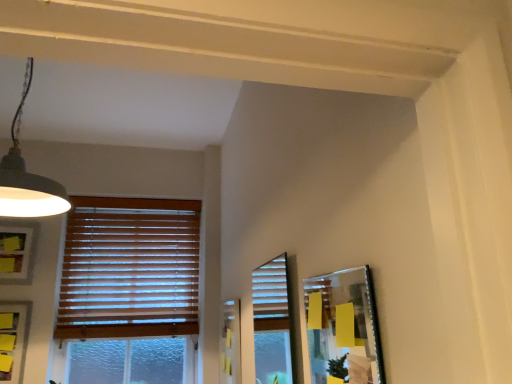
Describe the element at coordinates (130, 268) in the screenshot. I see `wooden blinds at left` at that location.

Image resolution: width=512 pixels, height=384 pixels. What do you see at coordinates (13, 339) in the screenshot?
I see `matte gray picture frame at lower left, which appears as the second picture frame when viewed from the right` at bounding box center [13, 339].

Describe the element at coordinates (27, 176) in the screenshot. I see `matte black lampshade at upper left` at that location.

Identify the location of metallic silver picture frame at right, placed as the 3th picture frame when sorted from left to right. coord(343,328).

Who is taller, metallic silver picture frame at right, placed as the 3th picture frame when sorted from left to right, or matte black lampshade at upper left?

matte black lampshade at upper left is taller.

Which object is closer to the camera taking this photo, metallic silver picture frame at right, marked as the first picture frame in a front-to-back arrangement, or matte black lampshade at upper left?

metallic silver picture frame at right, marked as the first picture frame in a front-to-back arrangement, is more forward.

Which is more to the right, metallic silver picture frame at right, arranged as the 1th picture frame when viewed from the right, or matte black lampshade at upper left?

metallic silver picture frame at right, arranged as the 1th picture frame when viewed from the right, is more to the right.

Is metallic silver picture frame at right, placed as the 3th picture frame when sorted from left to right, turned away from matte black lampshade at upper left?

No, metallic silver picture frame at right, placed as the 3th picture frame when sorted from left to right,'s orientation is not away from matte black lampshade at upper left.

In the scene shown: Which is more to the right, matte white picture frame at left, the 3th picture frame viewed from the front, or matte gray picture frame at lower left, the 2th picture frame in the left-to-right sequence?

From the viewer's perspective, matte gray picture frame at lower left, the 2th picture frame in the left-to-right sequence, appears more on the right side.

Would you consider matte white picture frame at left, which is the first picture frame from left to right, to be distant from matte gray picture frame at lower left, which is the second picture frame from back to front?

No, there isn't a large distance between matte white picture frame at left, which is the first picture frame from left to right, and matte gray picture frame at lower left, which is the second picture frame from back to front.

From the image's perspective, is matte white picture frame at left, positioned as the 3th picture frame in right-to-left order, beneath matte gray picture frame at lower left, acting as the second picture frame starting from the front?

No, from the image's perspective, matte white picture frame at left, positioned as the 3th picture frame in right-to-left order, is not beneath matte gray picture frame at lower left, acting as the second picture frame starting from the front.

From their relative heights in the image, would you say matte black lampshade at upper left is taller or shorter than matte white picture frame at left, which is the first picture frame in back-to-front order?

matte black lampshade at upper left is taller than matte white picture frame at left, which is the first picture frame in back-to-front order.

In the image, is matte black lampshade at upper left on the left side or the right side of matte white picture frame at left, positioned as the 3th picture frame in right-to-left order?

In the image, matte black lampshade at upper left appears on the right side of matte white picture frame at left, positioned as the 3th picture frame in right-to-left order.

Considering the relative positions of matte black lampshade at upper left and matte white picture frame at left, positioned as the 3th picture frame in right-to-left order, in the image provided, is matte black lampshade at upper left behind matte white picture frame at left, positioned as the 3th picture frame in right-to-left order,?

No, matte black lampshade at upper left is closer to the viewer.

Is matte white picture frame at left, the 3th picture frame viewed from the front, a part of matte black lampshade at upper left?

No, matte white picture frame at left, the 3th picture frame viewed from the front, is not a part of matte black lampshade at upper left.

Is metallic silver picture frame at right, marked as the first picture frame in a front-to-back arrangement, oriented towards matte gray picture frame at lower left, the 2th picture frame in the left-to-right sequence?

No, metallic silver picture frame at right, marked as the first picture frame in a front-to-back arrangement, does not turn towards matte gray picture frame at lower left, the 2th picture frame in the left-to-right sequence.

Who is smaller, metallic silver picture frame at right, placed as the 3th picture frame when sorted from left to right, or matte gray picture frame at lower left, which is the second picture frame from back to front?

matte gray picture frame at lower left, which is the second picture frame from back to front.

Does point (353, 279) lie behind point (15, 337)?

No, (353, 279) is in front of (15, 337).

Based on the photo, is metallic silver picture frame at right, marked as the first picture frame in a front-to-back arrangement, inside the boundaries of matte gray picture frame at lower left, which is the second picture frame from back to front, or outside?

metallic silver picture frame at right, marked as the first picture frame in a front-to-back arrangement, is not inside matte gray picture frame at lower left, which is the second picture frame from back to front, it's outside.

Are metallic silver picture frame at right, marked as the first picture frame in a front-to-back arrangement, and matte white picture frame at left, which is the first picture frame in back-to-front order, far apart?

Absolutely, metallic silver picture frame at right, marked as the first picture frame in a front-to-back arrangement, is distant from matte white picture frame at left, which is the first picture frame in back-to-front order.

From the image's perspective, which is above, metallic silver picture frame at right, arranged as the 1th picture frame when viewed from the right, or matte white picture frame at left, which is the first picture frame from left to right?

metallic silver picture frame at right, arranged as the 1th picture frame when viewed from the right, appears higher in the image.

Between point (367, 375) and point (7, 257), which one is positioned in front?

The point (367, 375) is more forward.

Locate an element on the screen. The height and width of the screenshot is (384, 512). the 2nd picture frame behind when counting from the metallic silver picture frame at right, marked as the first picture frame in a front-to-back arrangement is located at coordinates (17, 252).

Is matte black lampshade at upper left with metallic silver picture frame at right, placed as the 3th picture frame when sorted from left to right?

matte black lampshade at upper left is not next to metallic silver picture frame at right, placed as the 3th picture frame when sorted from left to right, and they're not touching.

At what (x,y) coordinates should I click in order to perform the action: click on picture frame in front of the matte black lampshade at upper left. Please return your answer as a coordinate pair (x, y). Image resolution: width=512 pixels, height=384 pixels. Looking at the image, I should click on (343, 328).

Which object is further away from the camera taking this photo, matte black lampshade at upper left or metallic silver picture frame at right, arranged as the 1th picture frame when viewed from the right?

matte black lampshade at upper left is further away from the camera.

Is matte gray picture frame at lower left, which appears as the second picture frame when viewed from the right, to the left of metallic silver picture frame at right, which is the 3th picture frame in back-to-front order, from the viewer's perspective?

Indeed, matte gray picture frame at lower left, which appears as the second picture frame when viewed from the right, is positioned on the left side of metallic silver picture frame at right, which is the 3th picture frame in back-to-front order.

Is matte gray picture frame at lower left, which is the second picture frame from back to front, positioned far away from metallic silver picture frame at right, arranged as the 1th picture frame when viewed from the right?

That's right, there is a large distance between matte gray picture frame at lower left, which is the second picture frame from back to front, and metallic silver picture frame at right, arranged as the 1th picture frame when viewed from the right.

Considering the relative sizes of matte gray picture frame at lower left, acting as the second picture frame starting from the front, and metallic silver picture frame at right, which is the 3th picture frame in back-to-front order, in the image provided, is matte gray picture frame at lower left, acting as the second picture frame starting from the front, smaller than metallic silver picture frame at right, which is the 3th picture frame in back-to-front order,?

Correct, matte gray picture frame at lower left, acting as the second picture frame starting from the front, occupies less space than metallic silver picture frame at right, which is the 3th picture frame in back-to-front order.

The height and width of the screenshot is (384, 512). What are the coordinates of `picture frame on the right of the matte black lampshade at upper left` in the screenshot? It's located at (343, 328).

Locate an element on the screen. The height and width of the screenshot is (384, 512). picture frame that appears behind the matte gray picture frame at lower left, acting as the second picture frame starting from the front is located at coordinates (17, 252).

Based on their spatial positions, is matte black lampshade at upper left or matte gray picture frame at lower left, which appears as the second picture frame when viewed from the right, further from matte white picture frame at left, which is the first picture frame from left to right?

matte black lampshade at upper left is further to matte white picture frame at left, which is the first picture frame from left to right.

Looking at the image, which one is located further to matte white picture frame at left, the 3th picture frame viewed from the front, metallic silver picture frame at right, which is the 3th picture frame in back-to-front order, or matte black lampshade at upper left?

metallic silver picture frame at right, which is the 3th picture frame in back-to-front order, is further to matte white picture frame at left, the 3th picture frame viewed from the front.

From the image, which object appears to be farther from matte white picture frame at left, which is the first picture frame from left to right, matte black lampshade at upper left or metallic silver picture frame at right, arranged as the 1th picture frame when viewed from the right?

Among the two, metallic silver picture frame at right, arranged as the 1th picture frame when viewed from the right, is located further to matte white picture frame at left, which is the first picture frame from left to right.

From the image, which object appears to be nearer to metallic silver picture frame at right, marked as the first picture frame in a front-to-back arrangement, matte gray picture frame at lower left, the 2th picture frame in the left-to-right sequence, or wooden blinds at left?

wooden blinds at left lies closer to metallic silver picture frame at right, marked as the first picture frame in a front-to-back arrangement, than the other object.

Looking at the image, which one is located closer to metallic silver picture frame at right, arranged as the 1th picture frame when viewed from the right, matte black lampshade at upper left or wooden blinds at left?

matte black lampshade at upper left lies closer to metallic silver picture frame at right, arranged as the 1th picture frame when viewed from the right, than the other object.

From the image, which object appears to be nearer to wooden blinds at left, matte gray picture frame at lower left, which is the second picture frame from back to front, or matte black lampshade at upper left?

Among the two, matte gray picture frame at lower left, which is the second picture frame from back to front, is located nearer to wooden blinds at left.

Which object lies nearer to the anchor point wooden blinds at left, matte black lampshade at upper left or matte white picture frame at left, the 3th picture frame viewed from the front?

Based on the image, matte white picture frame at left, the 3th picture frame viewed from the front, appears to be nearer to wooden blinds at left.

From the image, which object appears to be nearer to metallic silver picture frame at right, arranged as the 1th picture frame when viewed from the right, wooden blinds at left or matte white picture frame at left, which is the first picture frame from left to right?

wooden blinds at left.

The image size is (512, 384). I want to click on lamp between metallic silver picture frame at right, which is the 3th picture frame in back-to-front order, and wooden blinds at left from front to back, so click(x=27, y=176).

This screenshot has height=384, width=512. Find the location of `picture frame located between matte black lampshade at upper left and matte white picture frame at left, the 3th picture frame viewed from the front, in the depth direction`. picture frame located between matte black lampshade at upper left and matte white picture frame at left, the 3th picture frame viewed from the front, in the depth direction is located at coordinates coord(13,339).

I want to click on lamp between metallic silver picture frame at right, arranged as the 1th picture frame when viewed from the right, and matte gray picture frame at lower left, which appears as the second picture frame when viewed from the right, from front to back, so (x=27, y=176).

In order to click on lamp between metallic silver picture frame at right, which is the 3th picture frame in back-to-front order, and matte white picture frame at left, positioned as the 3th picture frame in right-to-left order, in the front-back direction in this screenshot , I will do `click(27, 176)`.